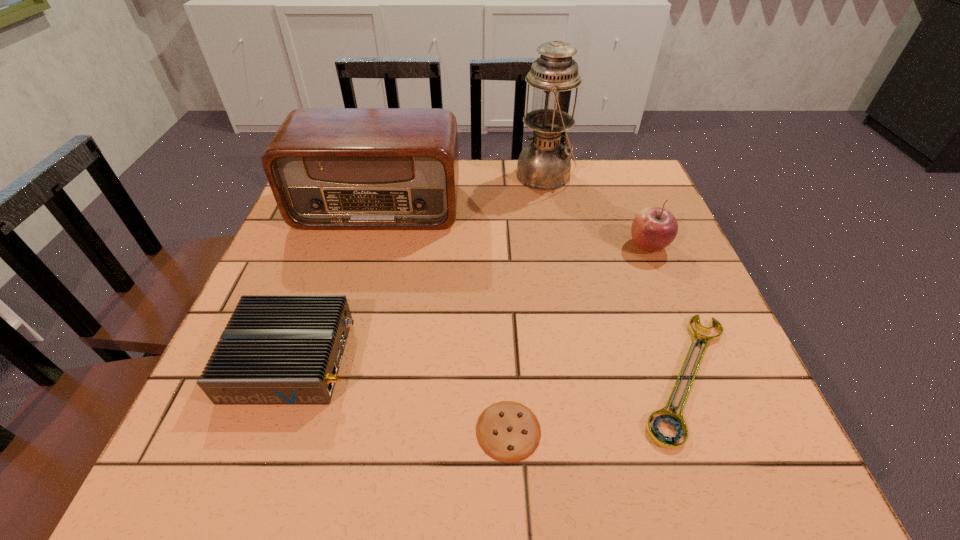
Identify which object is the third closest to the fourth object from right to left. Please provide its 2D coordinates. Your answer should be formatted as a tuple, i.e. [(x, y)], where the tuple contains the x and y coordinates of a point satisfying the conditions above.

[(654, 228)]

The width and height of the screenshot is (960, 540). In order to click on vacant space that satisfies the following two spatial constraints: 1. on the front panel of the radio receiver; 2. on the left side of the third tallest object in this screenshot , I will do `click(368, 246)`.

Where is `free spot that satisfies the following two spatial constraints: 1. on the back side of the cookie; 2. on the back panel of the fourth tallest object`? free spot that satisfies the following two spatial constraints: 1. on the back side of the cookie; 2. on the back panel of the fourth tallest object is located at coordinates (505, 359).

Where is `vacant area that satisfies the following two spatial constraints: 1. on the back panel of the router; 2. on the back side of the wrench`? vacant area that satisfies the following two spatial constraints: 1. on the back panel of the router; 2. on the back side of the wrench is located at coordinates (285, 376).

This screenshot has width=960, height=540. I want to click on free space that satisfies the following two spatial constraints: 1. on the back side of the third object from left to right; 2. on the left side of the wrench, so point(506,376).